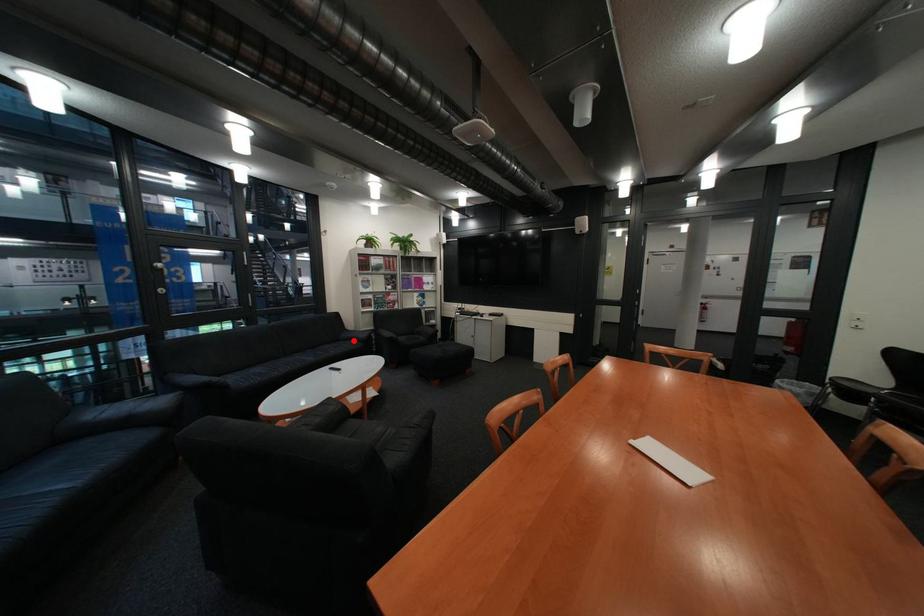
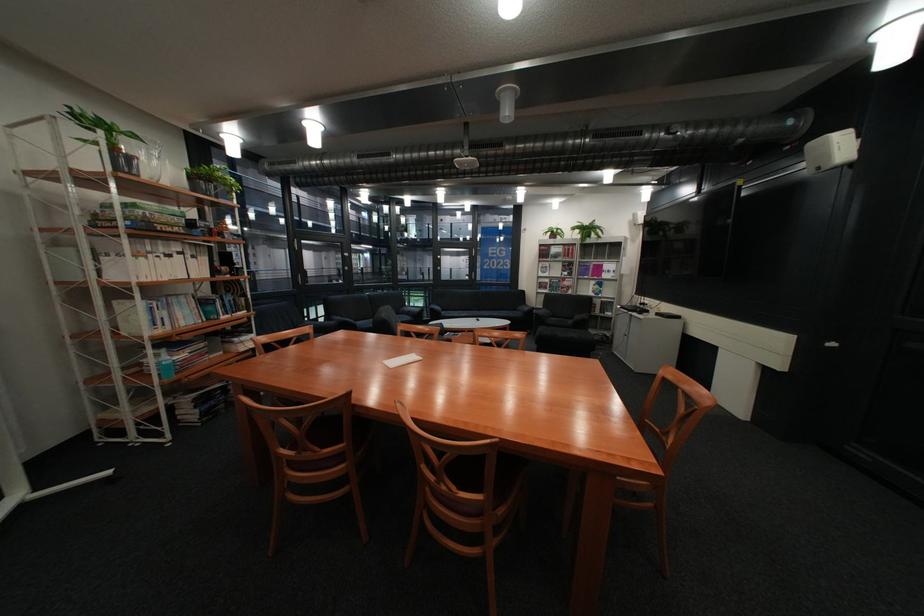
Question: I am providing you with two images of the same scene from different viewpoints. Given a red point in image1, look at the same physical point in image2. Is it:

Choices:
 (A) Closer to the viewpoint
 (B) Farther from the viewpoint

Answer: (B)